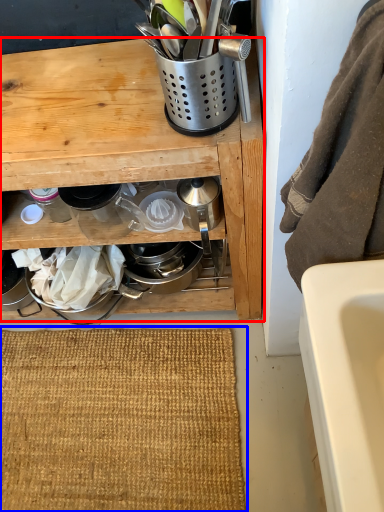
Question: Which point is further to the camera, cabinetry (highlighted by a red box) or doormat (highlighted by a blue box)?

Choices:
 (A) cabinetry
 (B) doormat

Answer: (B)